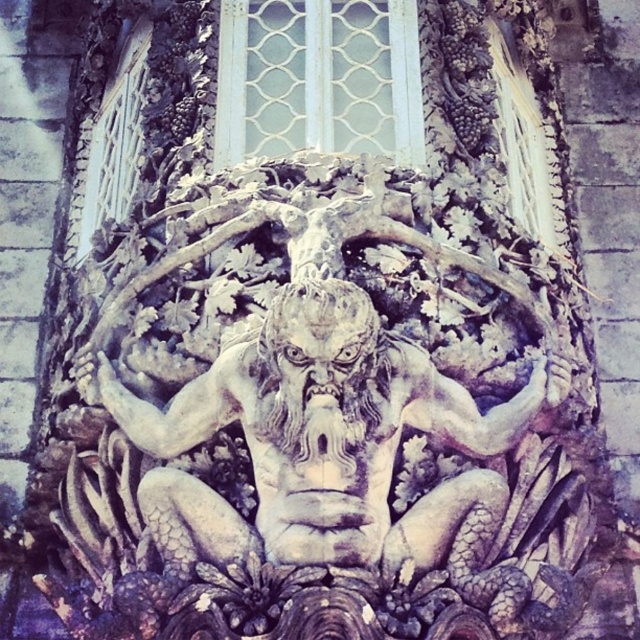
Consider the image. You are standing in front of the stone sculpture and want to take a photo of the point at coordinates point (234, 4). If your camera has a maximum focus range of 100 meters, will it be able to focus on that point?

The distance of point (234, 4) from viewer is 93.70 meters, so yes, the camera can focus on that point since it is within the maximum focus range of 100 meters.